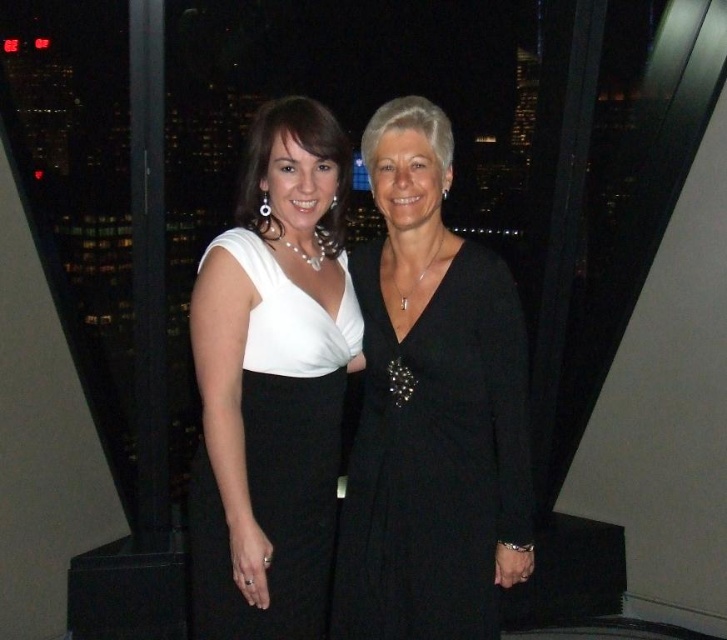
Consider the image. You are an interior designer planning to place a decorative item on a table near the black satin dress at center. To ensure it doesn not block the view of the dress, where should you position the item relative to the dress?

The black satin dress at center is located at point (430, 408), so placing the decorative item to the side or behind the dress would keep it visible without obstruction.

You are a fashion designer observing two dresses displayed in a store window. The black satin dress at center and the white satin dress at center are both on display. Which dress is taller?

The black satin dress at center is taller than the white satin dress at center.

You are a photographer setting up for a portrait in this scene. You notice a point at coordinates [430,408]. What object is located at that point?

The point at coordinates [430,408] marks the location of the black satin dress at center.